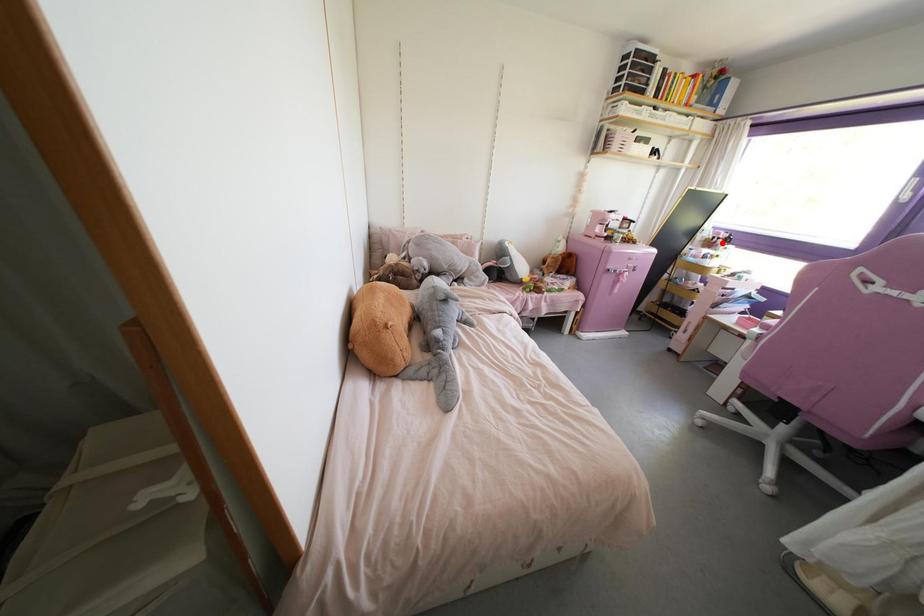
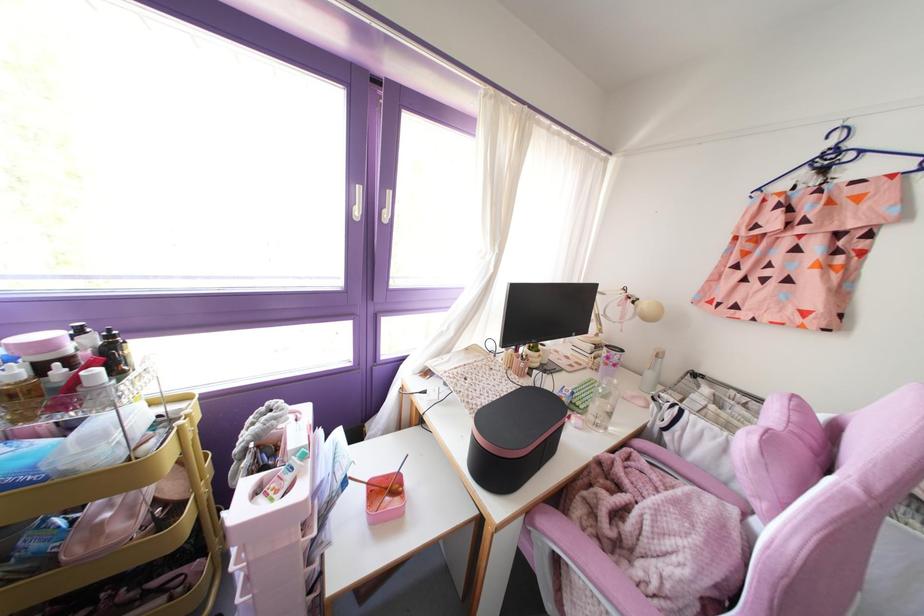
The point at the highlighted location is marked in the first image. Where is the corresponding point in the second image?

(116, 373)